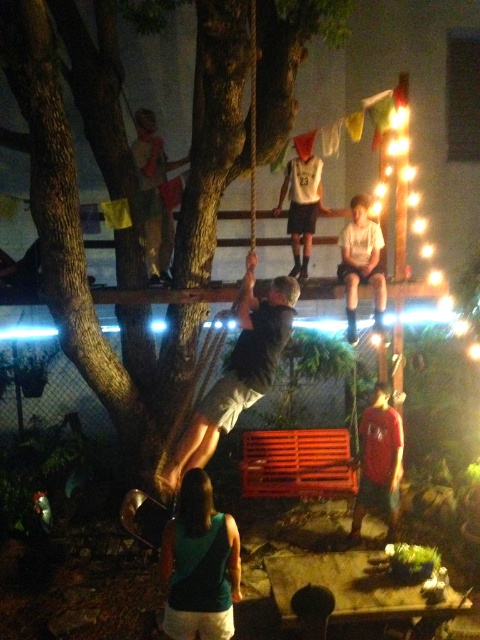
Does brown rough tree trunk at center appear over matte black shorts at center?

Yes.

Who is more distant from viewer, [29,1] or [340,237]?

The point [340,237] is more distant.

You are a GUI agent. You are given a task and a screenshot of the screen. Output one action in this format:
    pyautogui.click(x=<x>, y=<y>)
    Task: Click on the brown rough tree trunk at center
    The image size is (480, 640).
    Given the screenshot: What is the action you would take?
    pyautogui.click(x=78, y=220)

Between point (215, 193) and point (305, 618), which one is positioned behind?

Positioned behind is point (215, 193).

What do you see at coordinates (78, 220) in the screenshot? I see `brown rough tree trunk at center` at bounding box center [78, 220].

Which is in front, point (95, 330) or point (316, 605)?

Positioned in front is point (316, 605).

You are a GUI agent. You are given a task and a screenshot of the screen. Output one action in this format:
    pyautogui.click(x=<x>, y=<y>)
    Task: Click on the brown rough tree trunk at center
    The height and width of the screenshot is (640, 480).
    Given the screenshot: What is the action you would take?
    pyautogui.click(x=78, y=220)

Is camouflage fabric shirt at upper left thinner than matte red t-shirt at lower right?

Yes, camouflage fabric shirt at upper left is thinner than matte red t-shirt at lower right.

Which of these two, camouflage fabric shirt at upper left or matte red t-shirt at lower right, stands shorter?

camouflage fabric shirt at upper left

The width and height of the screenshot is (480, 640). I want to click on camouflage fabric shirt at upper left, so click(156, 195).

This screenshot has width=480, height=640. I want to click on camouflage fabric shirt at upper left, so [156, 195].